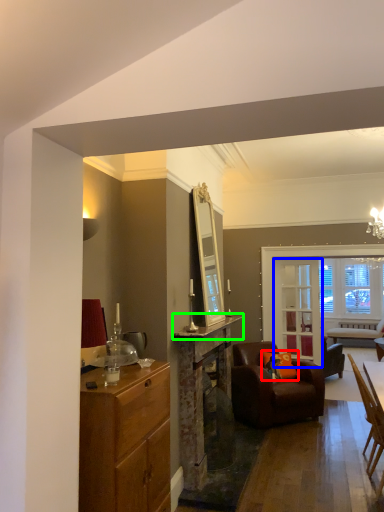
Question: Which object is the closest to the pillow (highlighted by a red box)? Choose among these: glass door (highlighted by a blue box) or counter top (highlighted by a green box).

Choices:
 (A) glass door
 (B) counter top

Answer: (A)